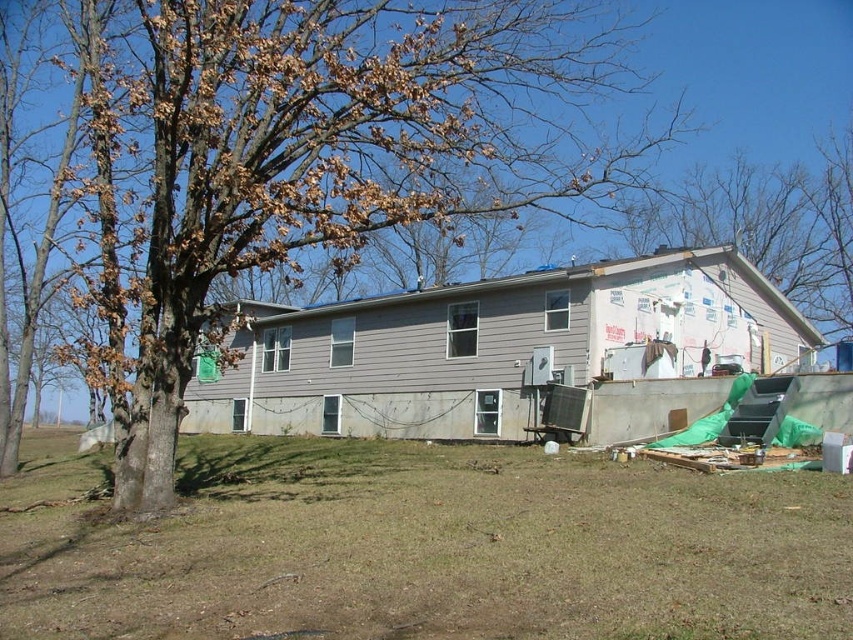
Question: Is brown grass at lower center closer to the viewer compared to brown leafy tree at left?

Choices:
 (A) no
 (B) yes

Answer: (B)

Question: Which object appears farthest from the camera in this image?

Choices:
 (A) brown grass at lower center
 (B) brown leafy tree at left

Answer: (B)

Question: Does brown grass at lower center appear on the left side of brown leafy tree at left?

Choices:
 (A) no
 (B) yes

Answer: (A)

Question: Which point appears closest to the camera in this image?

Choices:
 (A) pyautogui.click(x=556, y=497)
 (B) pyautogui.click(x=148, y=461)

Answer: (B)

Question: Does brown grass at lower center appear over brown leafy tree at left?

Choices:
 (A) yes
 (B) no

Answer: (B)